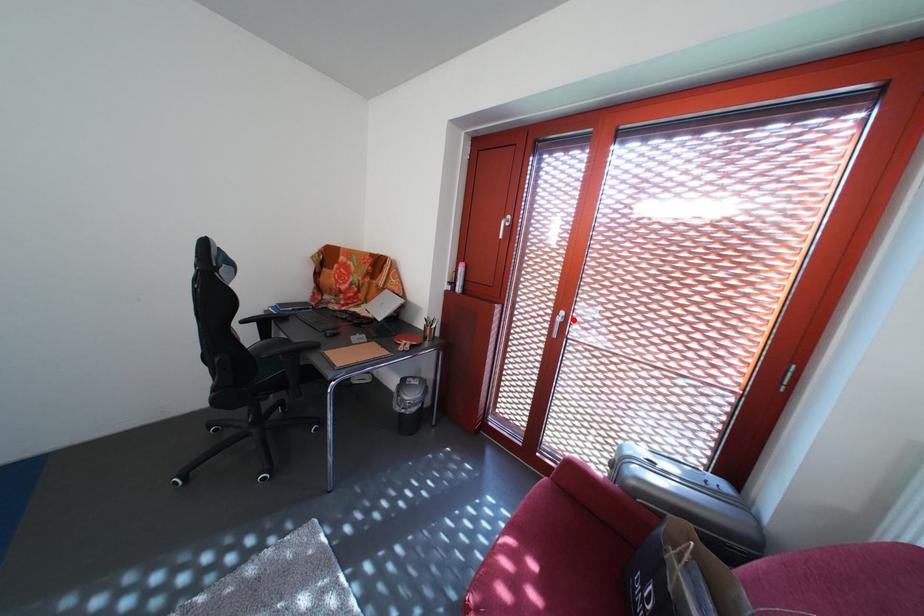
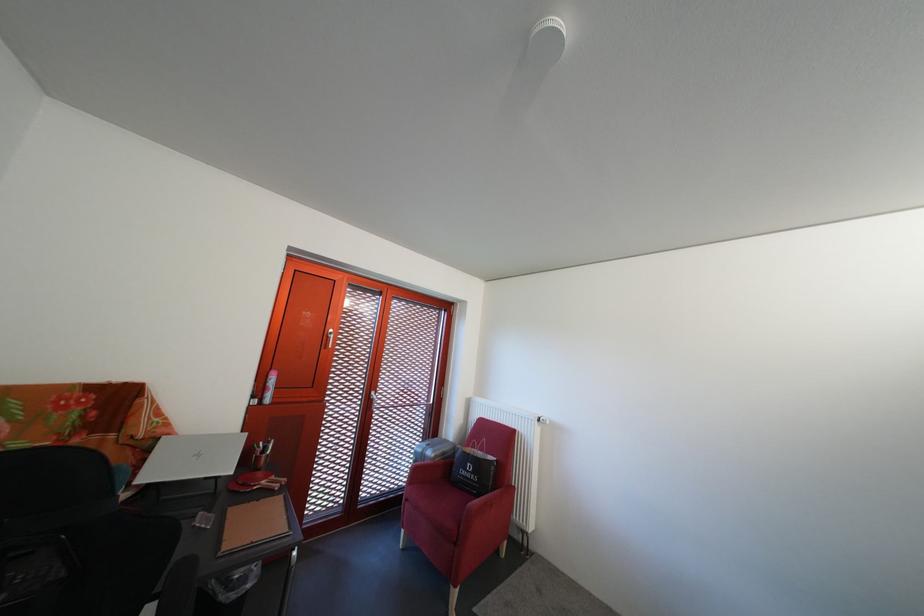
Locate, in the second image, the point that corresponds to the highlighted location in the first image.

(383, 400)